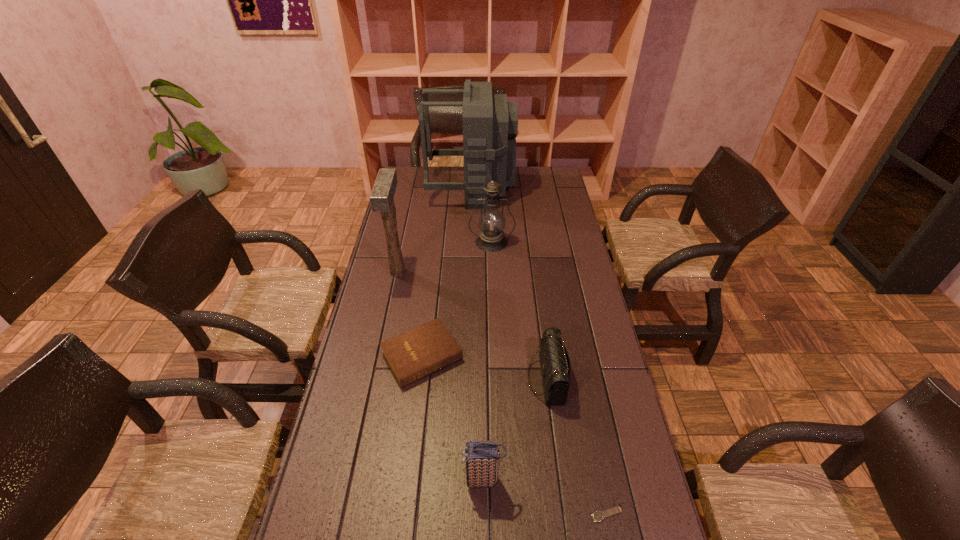
Where is `the second shortest object`? the second shortest object is located at coordinates (415, 354).

Locate an element on the screen. The height and width of the screenshot is (540, 960). the shortest object is located at coordinates (596, 516).

The width and height of the screenshot is (960, 540). Find the location of `the rightmost object`. the rightmost object is located at coordinates (596, 516).

Find the location of a particular element. This screenshot has width=960, height=540. vacant area situated 0.060m on the front compartment of the backpack is located at coordinates (527, 190).

This screenshot has width=960, height=540. Find the location of `vacant area located on the back of the mallet`. vacant area located on the back of the mallet is located at coordinates (410, 214).

Locate an element on the screen. The width and height of the screenshot is (960, 540). vacant space located 0.340m on the back of the oil lamp is located at coordinates (490, 191).

In order to click on vacant space located with the zip open on the fourth tallest object in this screenshot , I will do `click(342, 480)`.

The width and height of the screenshot is (960, 540). I want to click on vacant space located 0.220m with the zip open on the fourth tallest object, so click(374, 480).

Identify the location of free space located 0.070m with the zip open on the fourth tallest object. Image resolution: width=960 pixels, height=540 pixels. (435, 480).

What are the coordinates of `free space located 0.200m on the front flap of the shorter clutch bag` in the screenshot? It's located at (461, 378).